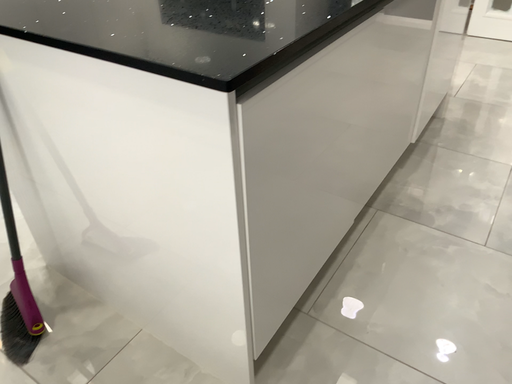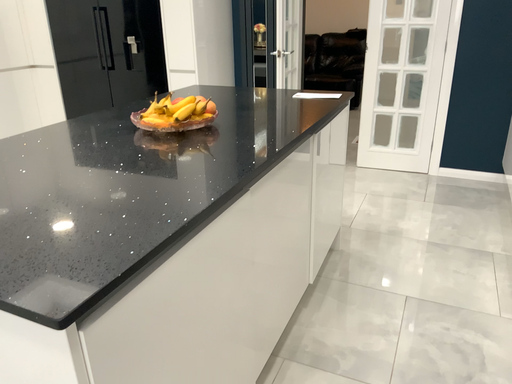
Question: Which way did the camera rotate in the video?

Choices:
 (A) rotated downward
 (B) rotated upward

Answer: (B)